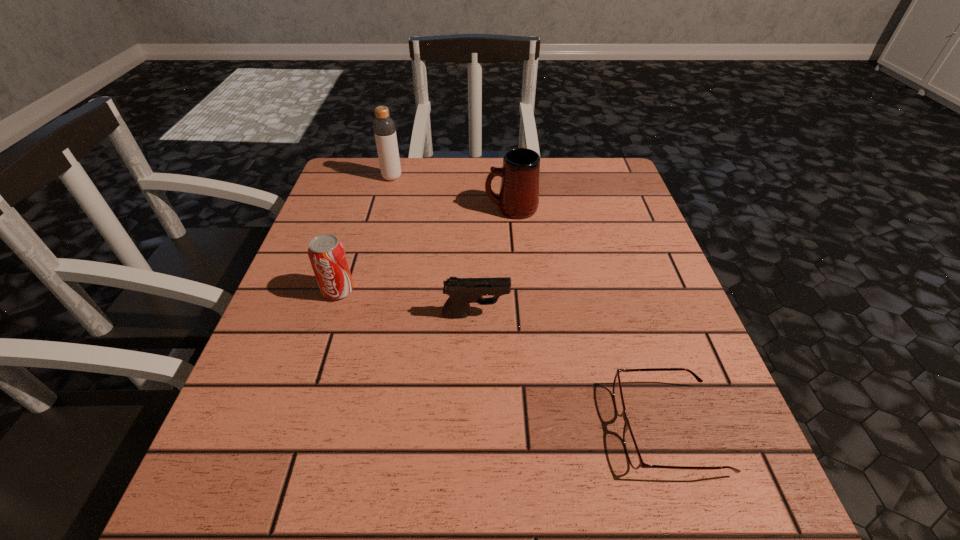
Locate an element on the screen. The image size is (960, 540). free location located 0.230m on the side of the mug with the handle is located at coordinates (392, 209).

Where is `vacant space situated on the side of the mug with the handle`? The height and width of the screenshot is (540, 960). vacant space situated on the side of the mug with the handle is located at coordinates pyautogui.click(x=448, y=209).

Locate an element on the screen. vacant space situated 0.190m on the side of the mug with the handle is located at coordinates (408, 209).

Where is `vacant space situated 0.230m on the logo side of the soda can`? This screenshot has height=540, width=960. vacant space situated 0.230m on the logo side of the soda can is located at coordinates (300, 409).

At what (x,y) coordinates should I click in order to perform the action: click on vacant space situated 0.140m at the barrel of the second nearest object. Please return your answer as a coordinate pair (x, y). The image size is (960, 540). Looking at the image, I should click on (583, 314).

Identify the location of vacant space situated 0.300m on the lenses of the rightmost object. This screenshot has height=540, width=960. (423, 428).

Where is `vacant space located on the lenses of the rightmost object`? vacant space located on the lenses of the rightmost object is located at coordinates (494, 428).

This screenshot has height=540, width=960. I want to click on free space located on the lenses of the rightmost object, so click(462, 428).

The width and height of the screenshot is (960, 540). What are the coordinates of `bottle that is at the far edge` in the screenshot? It's located at (384, 127).

Find the location of `mug that is at the far edge`. mug that is at the far edge is located at coordinates pyautogui.click(x=519, y=192).